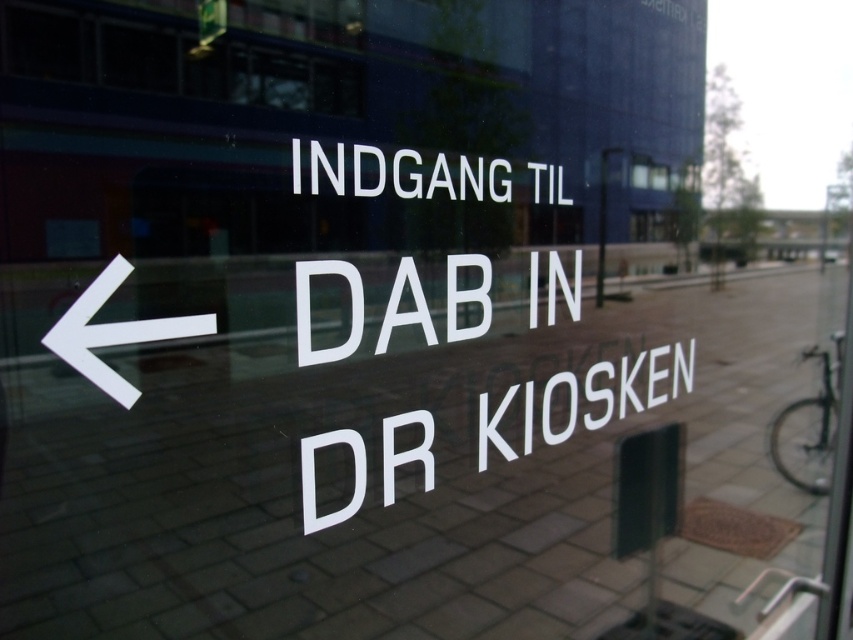
You are standing in front of a reflective glass surface that has a white glossy text at center. If you want to touch the physical text on the glass, where should you aim your hand relative to the reflection of the bicycle parked on the right side of the frame?

The white glossy text at center is located at point [635,384] in 2D space, so you should aim your hand towards the area that is 60.00000000000001 percent from the left edge and 74.6 percent from the top edge of the glass surface, which is to the left of the reflection of the bicycle parked on the right side of the frame.

You are standing in front of a reflective glass panel and see the white glossy text at center and the white glossy arrow at left. Which object appears bigger in the reflection?

The white glossy text at center appears bigger than the white glossy arrow at left in the reflection.